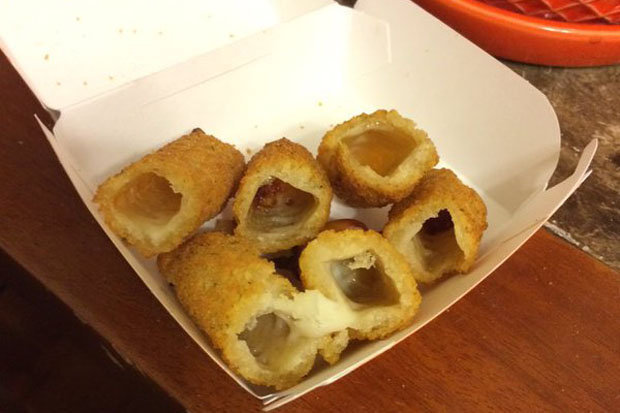
Identify the location of table. (559, 322).